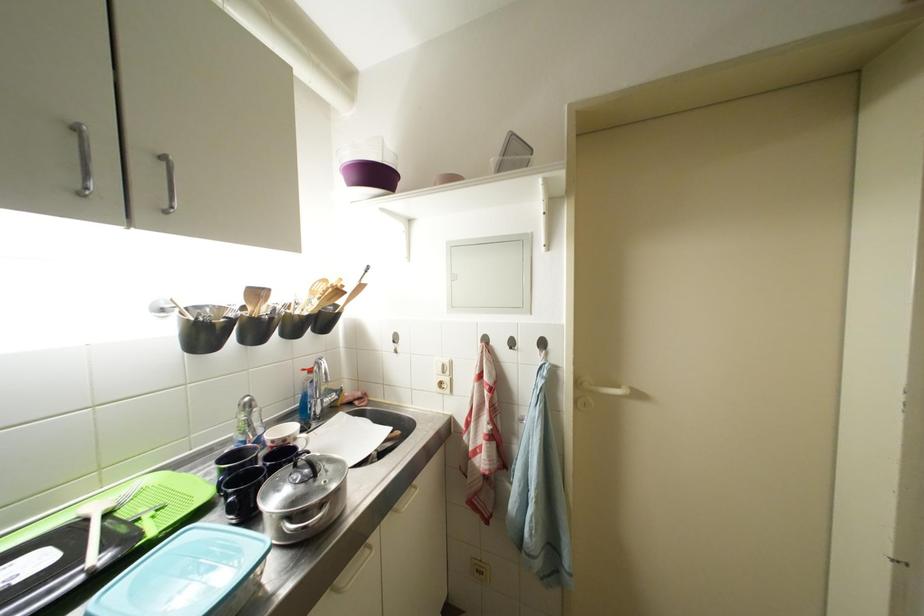
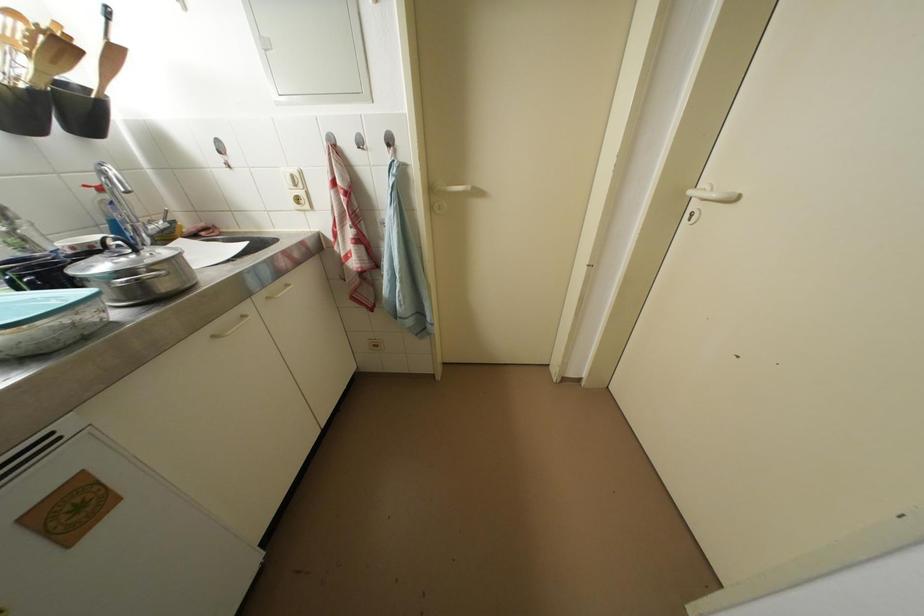
Where in the second image is the point corresponding to (333,403) from the first image?

(157, 231)